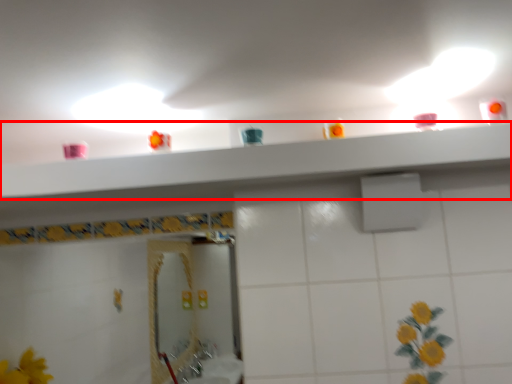
Question: Where is shelve (annotated by the red box) located in relation to shower in the image?

Choices:
 (A) left
 (B) right

Answer: (A)